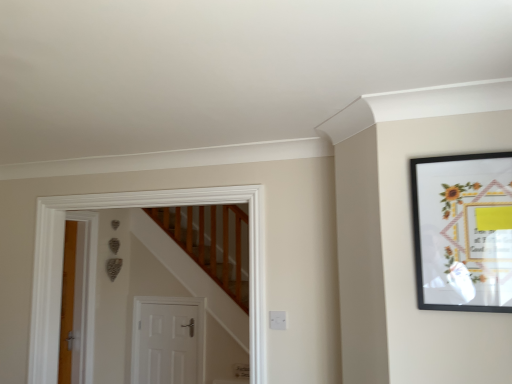
Question: From the image's perspective, is black matte picture frame at upper right above or below white matte door at center?

Choices:
 (A) above
 (B) below

Answer: (A)

Question: In the image, is black matte picture frame at upper right positioned in front of or behind white matte door at center?

Choices:
 (A) behind
 (B) front

Answer: (B)

Question: In terms of size, does black matte picture frame at upper right appear bigger or smaller than white matte door at center?

Choices:
 (A) big
 (B) small

Answer: (B)

Question: From the image's perspective, relative to black matte picture frame at upper right, is white matte door at center above or below?

Choices:
 (A) above
 (B) below

Answer: (B)

Question: Considering the relative positions of white matte door at center and black matte picture frame at upper right in the image provided, is white matte door at center to the left or to the right of black matte picture frame at upper right?

Choices:
 (A) right
 (B) left

Answer: (B)

Question: Is white matte door at center bigger or smaller than black matte picture frame at upper right?

Choices:
 (A) small
 (B) big

Answer: (B)

Question: From a real-world perspective, relative to black matte picture frame at upper right, is white matte door at center vertically above or below?

Choices:
 (A) below
 (B) above

Answer: (A)